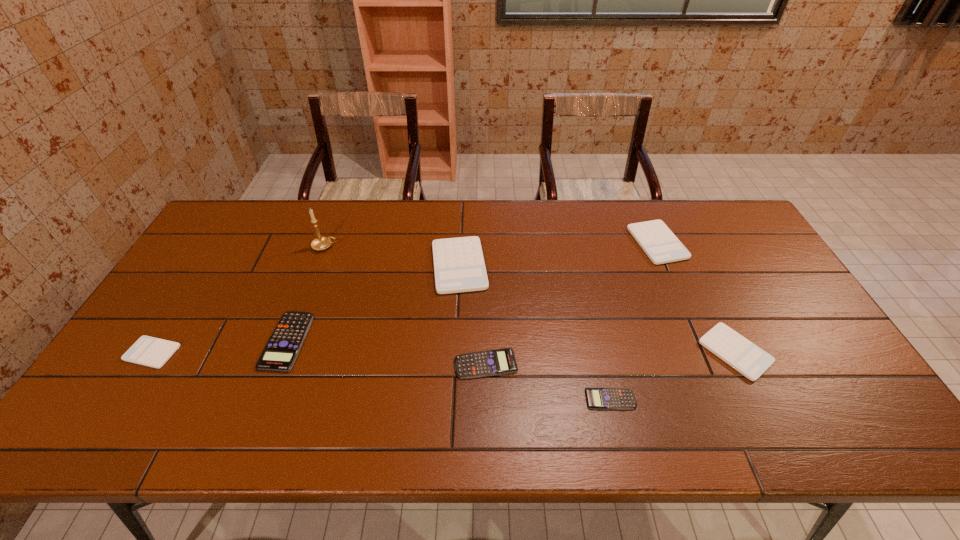
Find the location of a particular element. This screenshot has width=960, height=540. blue calculator that is the second nearest to the fifth shortest calculator is located at coordinates (495, 362).

The width and height of the screenshot is (960, 540). What are the coordinates of `blue calculator that can be found as the closest to the leftmost blue calculator` in the screenshot? It's located at (495, 362).

You are a GUI agent. You are given a task and a screenshot of the screen. Output one action in this format:
    pyautogui.click(x=<x>, y=<y>)
    Task: Click on the vacant position in the image that satisfies the following two spatial constraints: 1. on the back side of the nearest calculator; 2. on the right side of the third tallest calculator
    The width and height of the screenshot is (960, 540).
    Given the screenshot: What is the action you would take?
    pyautogui.click(x=600, y=352)

Where is `free space that satisfies the following two spatial constraints: 1. on the handle side of the shortest object; 2. on the right side of the tallest object`? The width and height of the screenshot is (960, 540). free space that satisfies the following two spatial constraints: 1. on the handle side of the shortest object; 2. on the right side of the tallest object is located at coordinates click(x=267, y=399).